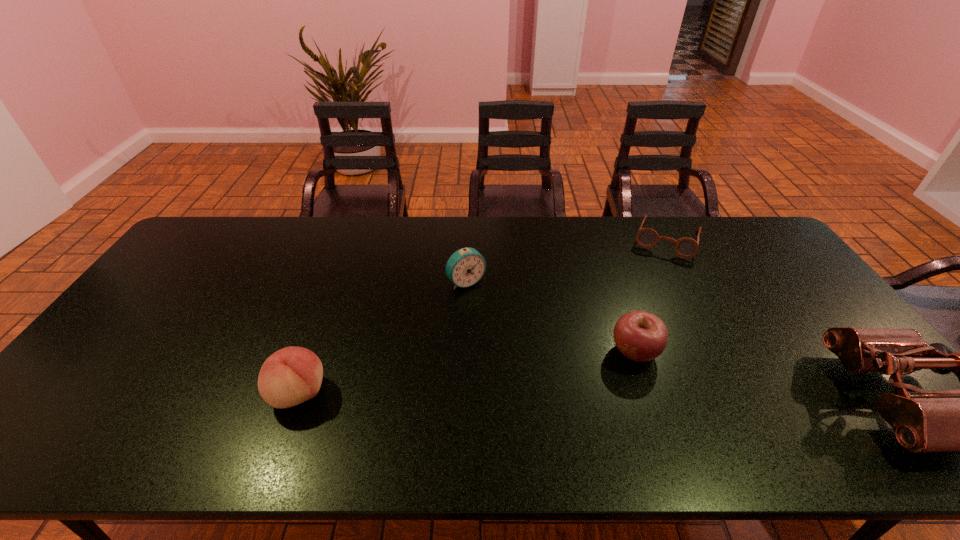
Find the location of a particular element. Image resolution: width=960 pixels, height=540 pixels. free space on the desktop that is between the peach and the rightmost object and is positioned on the front-facing side of the second farthest object is located at coordinates (558, 395).

Locate an element on the screen. The height and width of the screenshot is (540, 960). vacant space on the desktop that is between the leftmost object and the binoculars and is positioned on the side of the apple with the unique marking is located at coordinates (556, 395).

The width and height of the screenshot is (960, 540). In order to click on vacant spot on the desktop that is between the peach and the binoculars and is positioned on the front-facing side of the farthest object in this screenshot , I will do `click(623, 396)`.